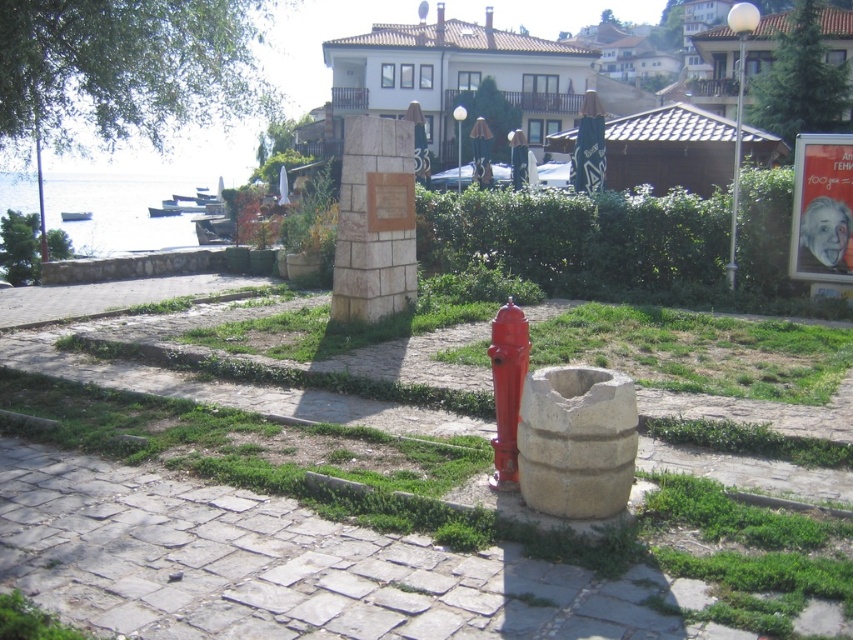
Does red matte hydrant at center have a lesser width compared to white stone plaque at center?

Yes, red matte hydrant at center is thinner than white stone plaque at center.

Identify the location of red matte hydrant at center. (508, 388).

Between stone plaque at center and red matte hydrant at center, which one appears on the right side from the viewer's perspective?

red matte hydrant at center

Who is lower down, stone plaque at center or red matte hydrant at center?

red matte hydrant at center is lower down.

Is point (409, 237) closer to camera compared to point (494, 440)?

No, (409, 237) is further to viewer.

You are a GUI agent. You are given a task and a screenshot of the screen. Output one action in this format:
    pyautogui.click(x=<x>, y=<y>)
    Task: Click on the stone plaque at center
    The image size is (853, 640).
    Given the screenshot: What is the action you would take?
    pyautogui.click(x=374, y=221)

Between stone plaque at center and white stone plaque at center, which one has more height?

stone plaque at center

Between stone plaque at center and white stone plaque at center, which one has less height?

white stone plaque at center is shorter.

The image size is (853, 640). Find the location of `stone plaque at center`. stone plaque at center is located at coordinates (374, 221).

The width and height of the screenshot is (853, 640). Identify the location of stone plaque at center. (374, 221).